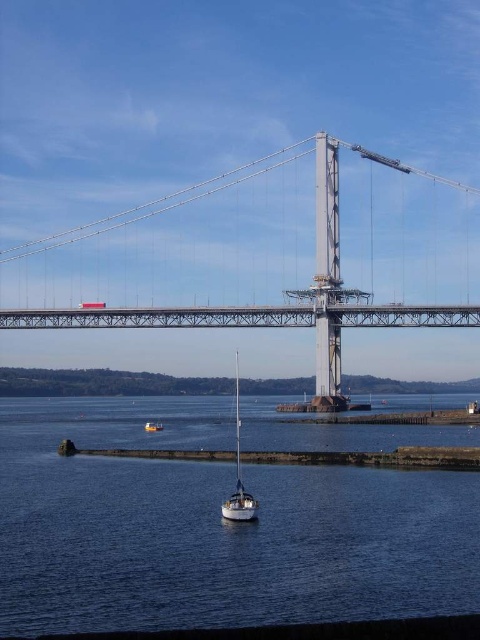
Question: Among these objects, which one is nearest to the camera?

Choices:
 (A) blue water at center
 (B) metallic gray suspension bridge at center

Answer: (A)

Question: Is blue water at center below metallic gray suspension bridge at center?

Choices:
 (A) yes
 (B) no

Answer: (A)

Question: Which object is farther from the camera taking this photo?

Choices:
 (A) white glossy sailboat at center
 (B) blue water at center

Answer: (A)

Question: Which object is closer to the camera taking this photo?

Choices:
 (A) metallic gray suspension bridge at center
 (B) white glossy sailboat at center

Answer: (B)

Question: Where is blue water at center located in relation to orange fiberglass boat at lower center in the image?

Choices:
 (A) left
 (B) right

Answer: (B)

Question: Can you confirm if blue water at center is smaller than orange fiberglass boat at lower center?

Choices:
 (A) yes
 (B) no

Answer: (B)